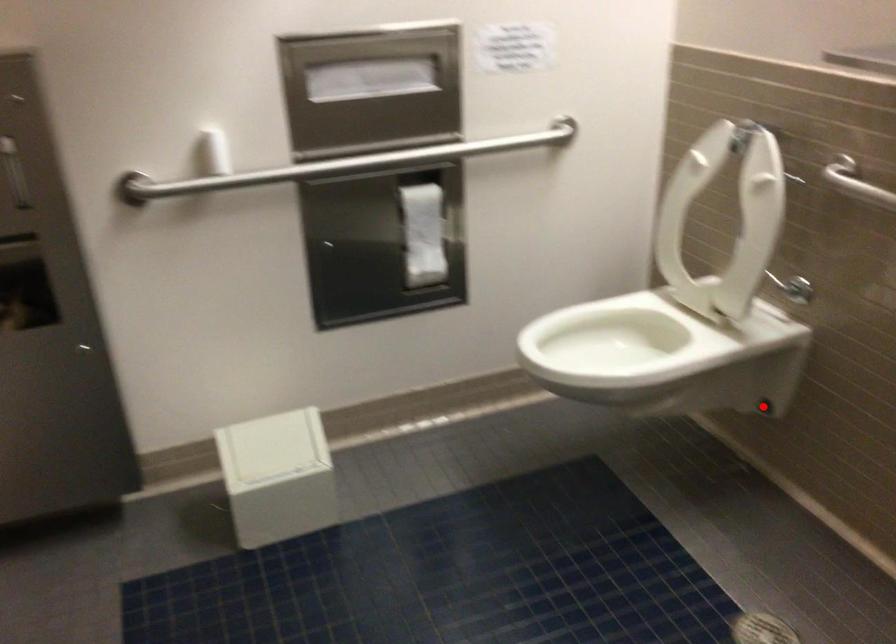
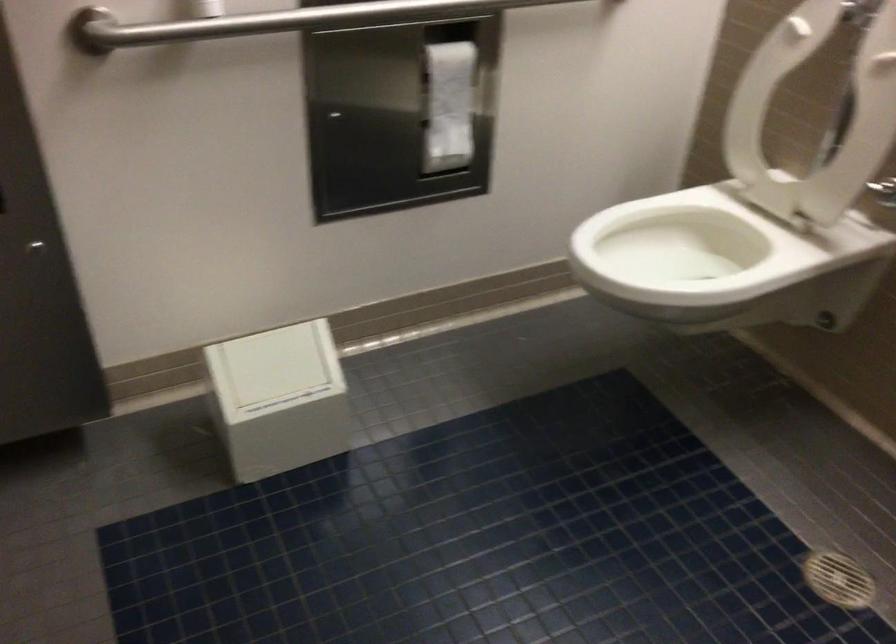
Find the pixel in the second image that matches the highlighted location in the first image.

(824, 321)